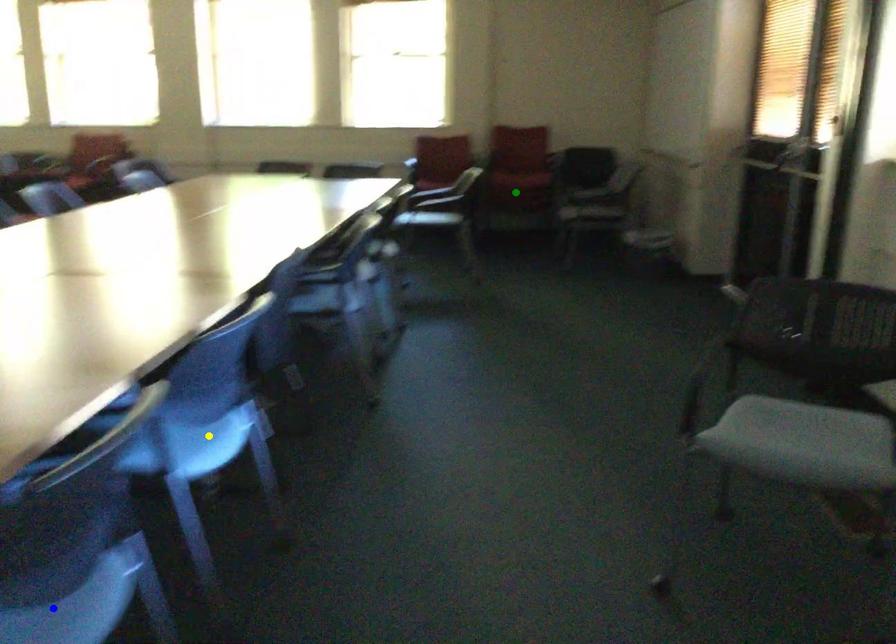
Order these from farthest to nearest:
- yellow point
- blue point
- green point

green point → yellow point → blue point